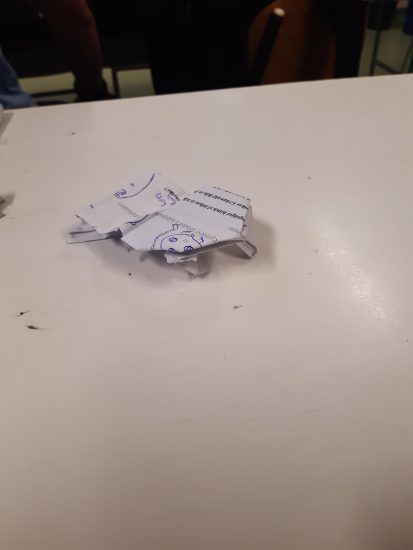
Locate an element on the screen. Image resolution: width=413 pixels, height=550 pixels. tabletop is located at coordinates (379, 177).